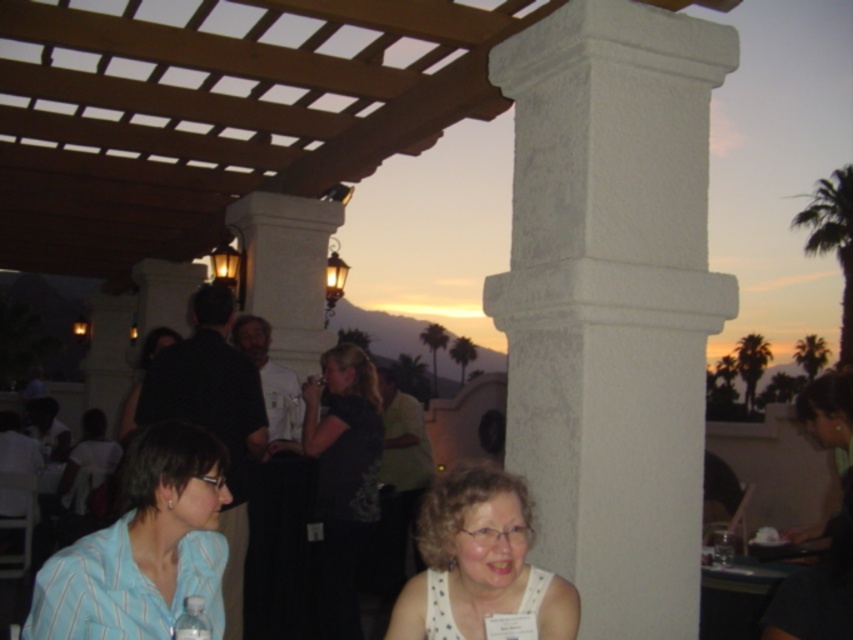
Who is more forward, (495, 566) or (169, 333)?

Point (495, 566) is in front.

Who is higher up, white dotted tank top at lower center or dark fabric dress at center?

Positioned higher is dark fabric dress at center.

Find the location of a particular element. white dotted tank top at lower center is located at coordinates (479, 563).

Does blue striped shirt at lower left have a lesser width compared to white dotted tank top at lower center?

Yes, blue striped shirt at lower left is thinner than white dotted tank top at lower center.

Does point (44, 588) come behind point (445, 620)?

No, it is not.

The image size is (853, 640). Find the location of `blue striped shirt at lower left`. blue striped shirt at lower left is located at coordinates (143, 547).

This screenshot has width=853, height=640. I want to click on blue striped shirt at lower left, so click(x=143, y=547).

Is blue striped shirt at lower left shorter than dark fabric dress at center?

In fact, blue striped shirt at lower left may be taller than dark fabric dress at center.

Describe the element at coordinates (143, 547) in the screenshot. I see `blue striped shirt at lower left` at that location.

Does point (126, 458) come farther from viewer compared to point (173, 342)?

No.

Identify the location of blue striped shirt at lower left. (143, 547).